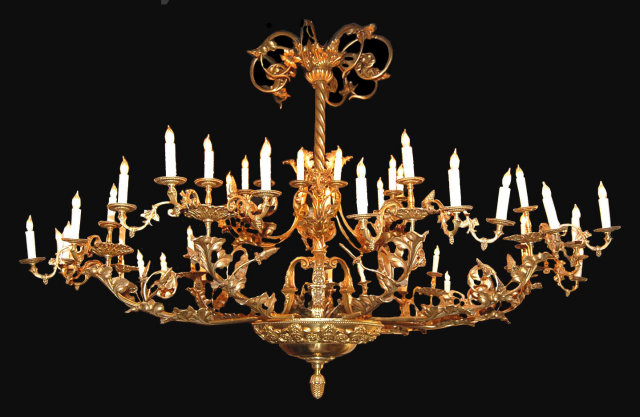
Locate an element on the screen. chandelier is located at coordinates (315, 242).